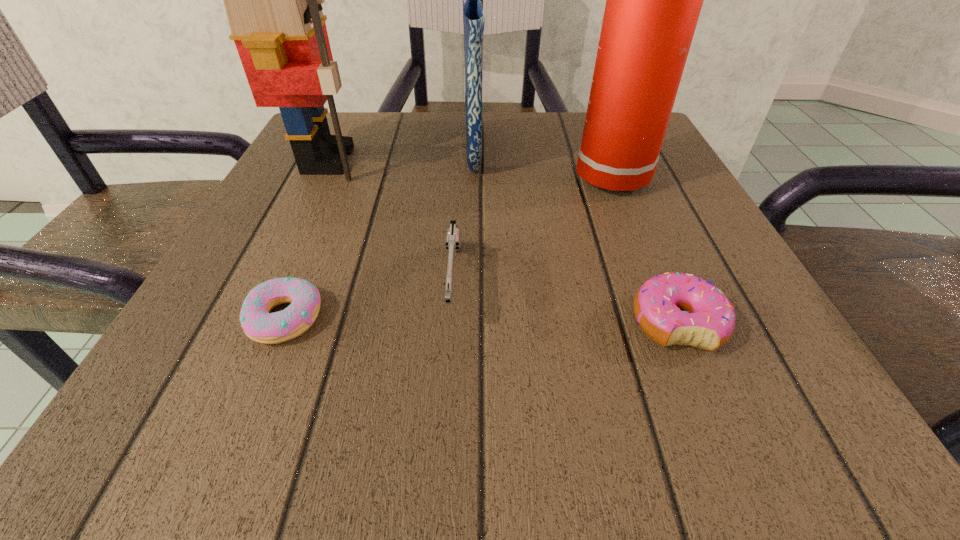
This screenshot has height=540, width=960. I want to click on object that can be found as the fifth closest to the taller doughnut, so click(273, 0).

Identify the location of the third closest object to the fourth tallest object. (681, 309).

This screenshot has width=960, height=540. Find the location of `vacant space that satisfies the following two spatial constraints: 1. on the front-facing side of the right doughnut; 2. on the left side of the fourth tallest object`. vacant space that satisfies the following two spatial constraints: 1. on the front-facing side of the right doughnut; 2. on the left side of the fourth tallest object is located at coordinates (451, 323).

The image size is (960, 540). Find the location of `vacant space that satisfies the following two spatial constraints: 1. on the front-facing side of the tallest object; 2. on the front-facing side of the third shortest object`. vacant space that satisfies the following two spatial constraints: 1. on the front-facing side of the tallest object; 2. on the front-facing side of the third shortest object is located at coordinates (472, 284).

The width and height of the screenshot is (960, 540). Identify the location of vacant space that satisfies the following two spatial constraints: 1. on the front-facing side of the right doughnut; 2. on the left side of the third shortest object. (451, 323).

What are the coordinates of `vacant space that satisfies the following two spatial constraints: 1. on the front-facing side of the taller doughnut; 2. on the right side of the shopping bag` in the screenshot? It's located at (471, 323).

Where is `vacant space that satisfies the following two spatial constraints: 1. on the front-facing side of the taller doughnut; 2. on the left side of the pistol`? vacant space that satisfies the following two spatial constraints: 1. on the front-facing side of the taller doughnut; 2. on the left side of the pistol is located at coordinates pyautogui.click(x=451, y=323).

Locate an element on the screen. free point that satisfies the following two spatial constraints: 1. in front of the nutcracker holding the staff; 2. on the left side of the shortest object is located at coordinates (251, 318).

Find the location of a particular element. This screenshot has height=540, width=960. vacant space that satisfies the following two spatial constraints: 1. in front of the nutcracker holding the staff; 2. on the right side of the shortest object is located at coordinates (251, 318).